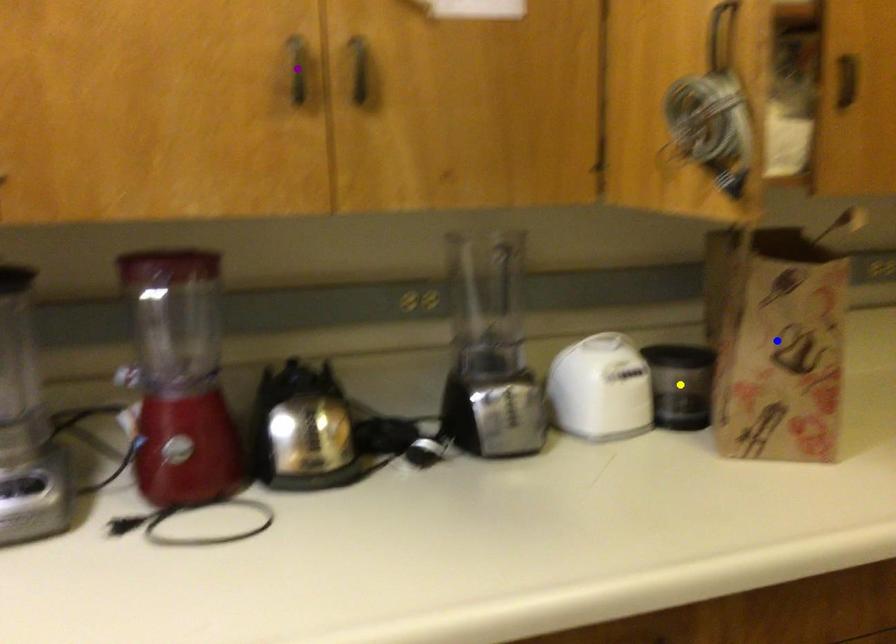
Order these from farthest to nearest:
purple point, blue point, yellow point

1. yellow point
2. blue point
3. purple point